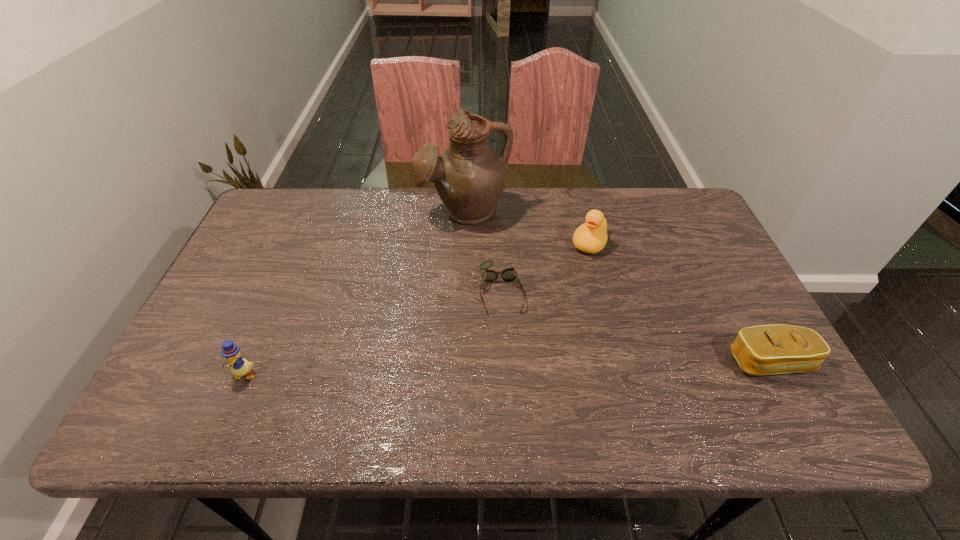
Find the location of a particular element. The image size is (960, 540). the third closest object relative to the second object from right to left is located at coordinates (767, 349).

The height and width of the screenshot is (540, 960). What are the coordinates of `free space that satisfies the following two spatial constraints: 1. on the front side of the spectacles; 2. on the right side of the tallest object` in the screenshot? It's located at (461, 292).